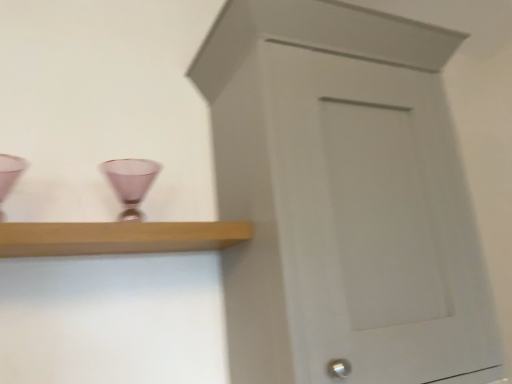
Question: Is white painted wood cupboard at center thinner than light wood shelf at upper left?

Choices:
 (A) yes
 (B) no

Answer: (B)

Question: Is white painted wood cupboard at center completely or partially outside of light wood shelf at upper left?

Choices:
 (A) no
 (B) yes

Answer: (B)

Question: Considering the relative sizes of white painted wood cupboard at center and light wood shelf at upper left in the image provided, is white painted wood cupboard at center bigger than light wood shelf at upper left?

Choices:
 (A) yes
 (B) no

Answer: (A)

Question: Would you consider white painted wood cupboard at center to be distant from light wood shelf at upper left?

Choices:
 (A) yes
 (B) no

Answer: (B)

Question: Can you confirm if white painted wood cupboard at center is positioned to the left of light wood shelf at upper left?

Choices:
 (A) yes
 (B) no

Answer: (B)

Question: Is matte pink glass at center wider or thinner than white painted wood cupboard at center?

Choices:
 (A) wide
 (B) thin

Answer: (B)

Question: In terms of size, does matte pink glass at center appear bigger or smaller than white painted wood cupboard at center?

Choices:
 (A) big
 (B) small

Answer: (B)

Question: Considering their positions, is matte pink glass at center located in front of or behind white painted wood cupboard at center?

Choices:
 (A) front
 (B) behind

Answer: (B)

Question: From a real-world perspective, is matte pink glass at center positioned above or below white painted wood cupboard at center?

Choices:
 (A) above
 (B) below

Answer: (A)

Question: Visually, is light wood shelf at upper left positioned to the left or to the right of white painted wood cupboard at center?

Choices:
 (A) left
 (B) right

Answer: (A)

Question: From a real-world perspective, is light wood shelf at upper left positioned above or below white painted wood cupboard at center?

Choices:
 (A) above
 (B) below

Answer: (B)

Question: Is light wood shelf at upper left in front of or behind white painted wood cupboard at center in the image?

Choices:
 (A) behind
 (B) front

Answer: (A)

Question: Is point (32, 251) closer or farther from the camera than point (231, 18)?

Choices:
 (A) farther
 (B) closer

Answer: (B)

Question: Looking at the image, does light wood shelf at upper left seem bigger or smaller compared to matte pink glass at center?

Choices:
 (A) small
 (B) big

Answer: (B)

Question: Considering the positions of light wood shelf at upper left and matte pink glass at center in the image, is light wood shelf at upper left taller or shorter than matte pink glass at center?

Choices:
 (A) short
 (B) tall

Answer: (A)